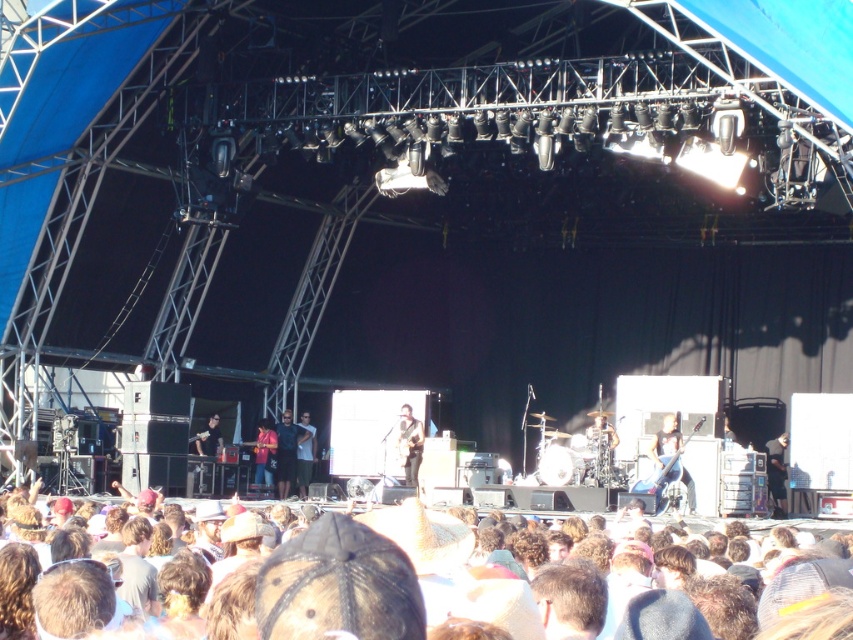
Is point (421, 451) positioned behind point (779, 470)?

That is False.

Who is higher up, shiny black guitar at center or black leather jacket at center?

shiny black guitar at center is higher up.

Locate an element on the screen. This screenshot has height=640, width=853. shiny black guitar at center is located at coordinates (410, 444).

Find the location of a particular element. light brown hair at lower center is located at coordinates (358, 572).

Is point (415, 593) positioned after point (413, 426)?

No, (415, 593) is in front of (413, 426).

The width and height of the screenshot is (853, 640). I want to click on light brown hair at lower center, so click(x=358, y=572).

Image resolution: width=853 pixels, height=640 pixels. In order to click on light brown hair at lower center in this screenshot , I will do coord(358,572).

Is point (267, 449) positioned behind point (206, 440)?

Yes, point (267, 449) is farther from viewer.

Image resolution: width=853 pixels, height=640 pixels. Identify the location of denim jacket at center. (264, 452).